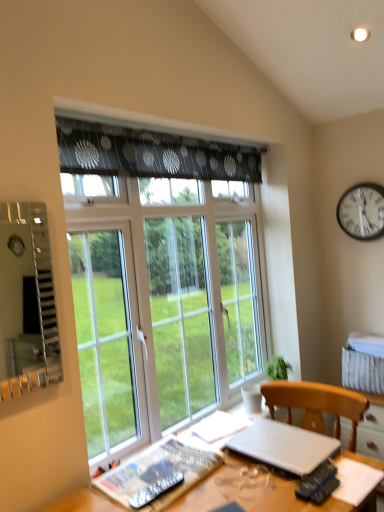
Question: Can you confirm if transparent glass window at center is thinner than silver metallic laptop at lower right?

Choices:
 (A) no
 (B) yes

Answer: (B)

Question: Can you confirm if transparent glass window at center is wider than silver metallic laptop at lower right?

Choices:
 (A) no
 (B) yes

Answer: (A)

Question: Considering the relative sizes of transparent glass window at center and silver metallic laptop at lower right in the image provided, is transparent glass window at center taller than silver metallic laptop at lower right?

Choices:
 (A) no
 (B) yes

Answer: (B)

Question: Would you say transparent glass window at center is outside silver metallic laptop at lower right?

Choices:
 (A) yes
 (B) no

Answer: (A)

Question: Considering the relative sizes of transparent glass window at center and silver metallic laptop at lower right in the image provided, is transparent glass window at center bigger than silver metallic laptop at lower right?

Choices:
 (A) no
 (B) yes

Answer: (B)

Question: Considering the positions of metallic silver remote at lower center and transparent glass window at center in the image, is metallic silver remote at lower center taller or shorter than transparent glass window at center?

Choices:
 (A) short
 (B) tall

Answer: (A)

Question: Would you say metallic silver remote at lower center is inside or outside transparent glass window at center?

Choices:
 (A) outside
 (B) inside

Answer: (A)

Question: From a real-world perspective, is metallic silver remote at lower center physically located above or below transparent glass window at center?

Choices:
 (A) below
 (B) above

Answer: (A)

Question: Is metallic silver remote at lower center bigger or smaller than transparent glass window at center?

Choices:
 (A) small
 (B) big

Answer: (A)

Question: Looking at their shapes, would you say black metal clock at upper right is wider or thinner than wooden desk at lower center?

Choices:
 (A) thin
 (B) wide

Answer: (A)

Question: Is point (339, 216) closer or farther from the camera than point (274, 504)?

Choices:
 (A) farther
 (B) closer

Answer: (A)

Question: Considering the positions of black metal clock at upper right and wooden desk at lower center in the image, is black metal clock at upper right taller or shorter than wooden desk at lower center?

Choices:
 (A) tall
 (B) short

Answer: (B)

Question: From the image's perspective, is black metal clock at upper right above or below wooden desk at lower center?

Choices:
 (A) below
 (B) above

Answer: (B)

Question: Considering the positions of transparent glass window at center and wooden desk at lower center in the image, is transparent glass window at center bigger or smaller than wooden desk at lower center?

Choices:
 (A) small
 (B) big

Answer: (B)

Question: Considering the positions of transparent glass window at center and wooden desk at lower center in the image, is transparent glass window at center wider or thinner than wooden desk at lower center?

Choices:
 (A) wide
 (B) thin

Answer: (B)